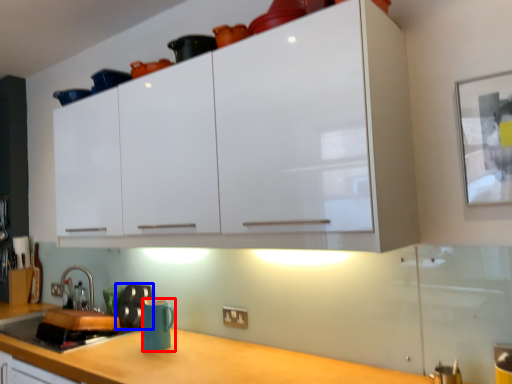
Question: Which object appears closest to the camera in this image, mug (highlighted by a red box) or appliance (highlighted by a blue box)?

Choices:
 (A) mug
 (B) appliance

Answer: (A)